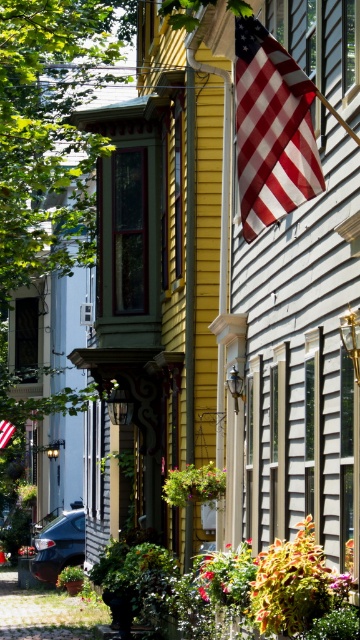
Question: Does american flag at upper right lie in front of american flag at upper center?

Choices:
 (A) no
 (B) yes

Answer: (B)

Question: Which object is farther from the camera taking this photo?

Choices:
 (A) american flag at upper center
 (B) american flag at upper right

Answer: (A)

Question: Does american flag at upper right appear on the right side of american flag at upper center?

Choices:
 (A) no
 (B) yes

Answer: (B)

Question: Which point is closer to the camera?

Choices:
 (A) pyautogui.click(x=279, y=172)
 (B) pyautogui.click(x=6, y=422)

Answer: (A)

Question: Among these objects, which one is farthest from the camera?

Choices:
 (A) american flag at upper center
 (B) american flag at upper right

Answer: (A)

Question: Is american flag at upper right further to the viewer compared to american flag at upper center?

Choices:
 (A) yes
 (B) no

Answer: (B)